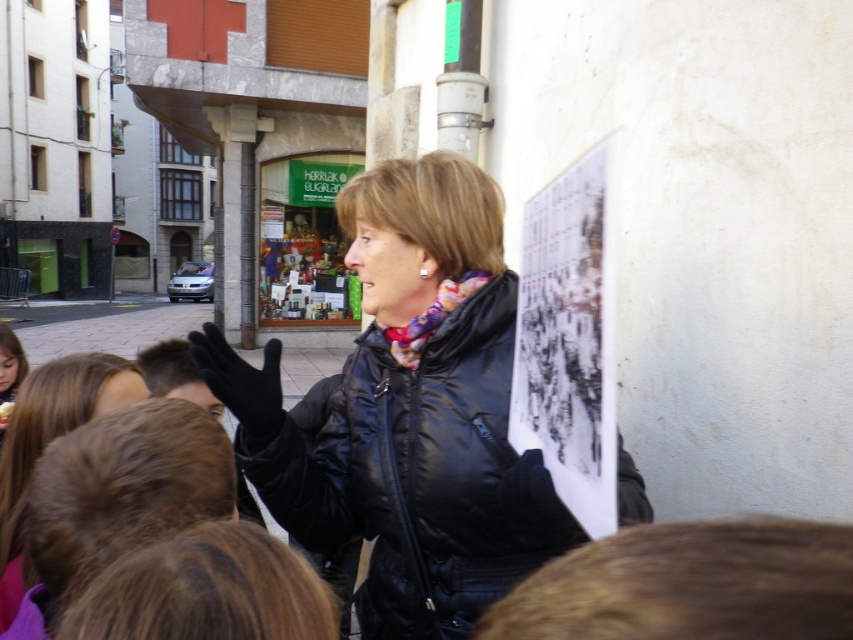
Question: Does black matte jacket at center appear over black paper at upper right?

Choices:
 (A) yes
 (B) no

Answer: (B)

Question: Does black matte jacket at center appear under black paper at upper right?

Choices:
 (A) no
 (B) yes

Answer: (B)

Question: Is black matte jacket at center wider than black paper at upper right?

Choices:
 (A) yes
 (B) no

Answer: (A)